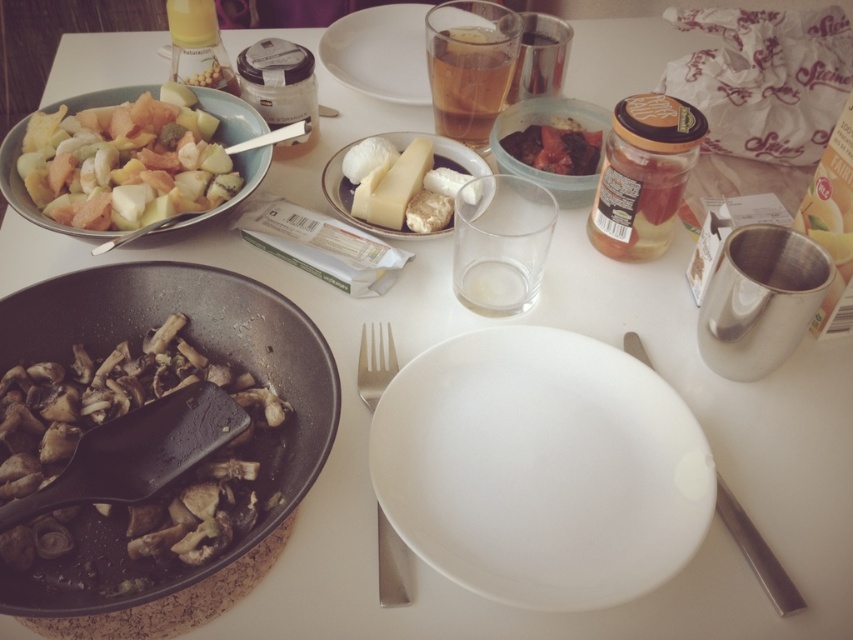
You are a chef preparing to serve a meal. You need to grab the shiny red jam jar at upper right to drizzle some jam onto the dish. However, you can only reach items within 30 centimeters. Can you reach it from where you are holding the satin silver fork at center?

The satin silver fork at center is 29.51 centimeters away from the shiny red jam jar at upper right. Since 29.51 cm is less than 30 cm, you can reach the shiny red jam jar at upper right while holding the satin silver fork at center.

You are setting up a table and want to place the satin silver fork at center on top of the white matte plate at center. Is this possible based on their sizes?

The white matte plate at center is larger than the satin silver fork at center, so yes, the satin silver fork at center can be placed on top of the white matte plate at center without overhanging.

Consider the image. You are a guest at the table and want to reach for both the satin silver fork at center and the shiny red jam jar at upper right. Which item will you need to reach further for?

The shiny red jam jar at upper right is further away from you than the satin silver fork at center, so you will need to reach further for the shiny red jam jar at upper right.